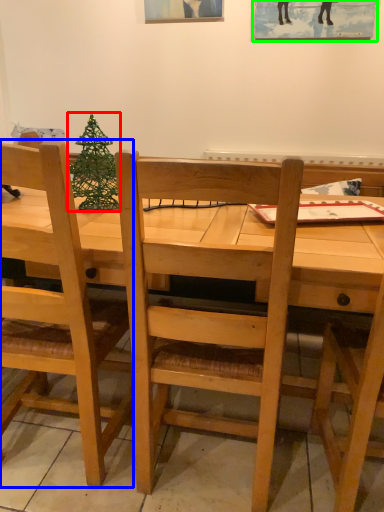
Question: Based on their relative distances, which object is nearer to christmas tree (highlighted by a red box)? Choose from chair (highlighted by a blue box) and picture frame (highlighted by a green box).

Choices:
 (A) chair
 (B) picture frame

Answer: (A)